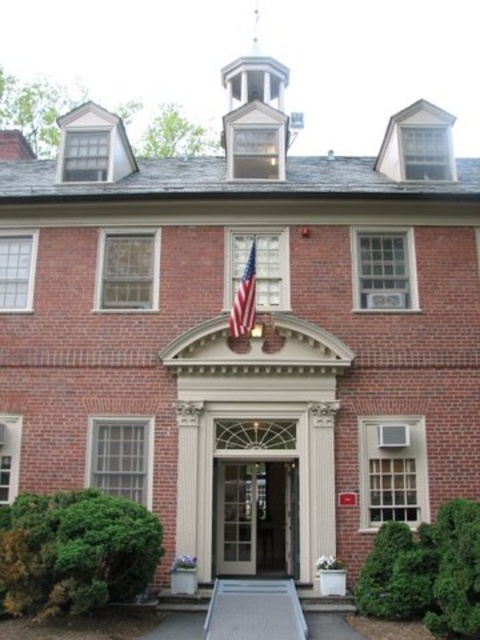
Question: Where is clear glass door at center located in relation to american flag at center in the image?

Choices:
 (A) above
 (B) below

Answer: (B)

Question: Among these objects, which one is farthest from the camera?

Choices:
 (A) american flag at center
 (B) clear glass door at center

Answer: (A)

Question: Among these objects, which one is nearest to the camera?

Choices:
 (A) american flag at center
 (B) clear glass door at center

Answer: (B)

Question: Is clear glass door at center positioned behind american flag at center?

Choices:
 (A) no
 (B) yes

Answer: (A)

Question: Can you confirm if clear glass door at center is wider than american flag at center?

Choices:
 (A) no
 (B) yes

Answer: (B)